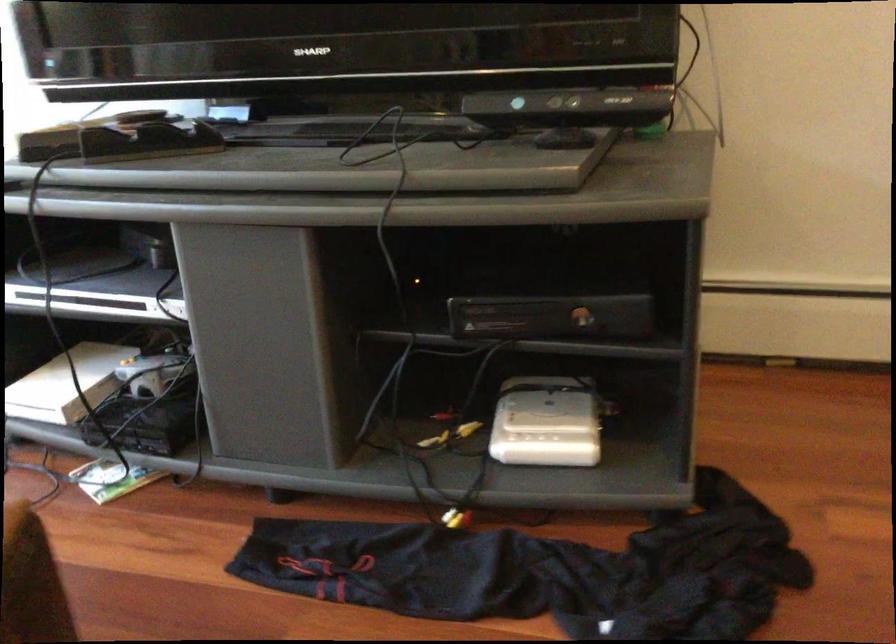
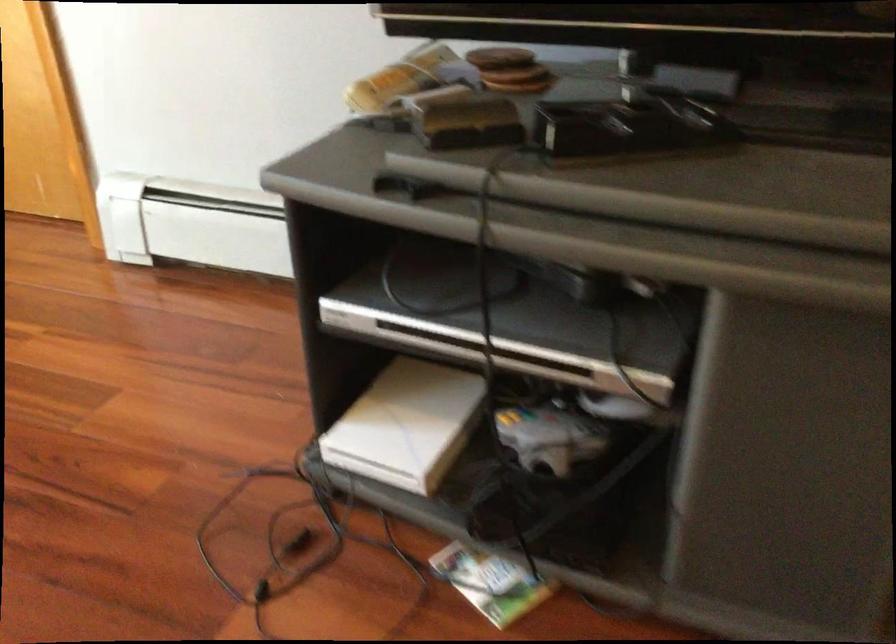
Where in the second image is the point corresponding to point (102, 289) from the first image?

(505, 321)